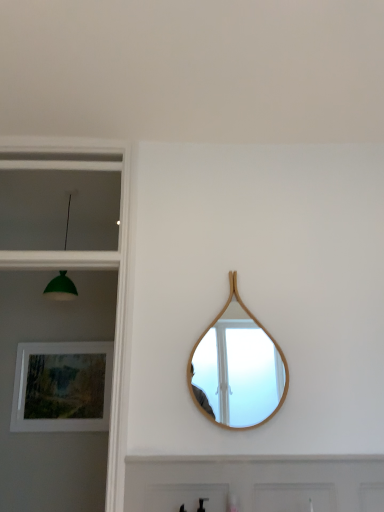
Question: Is white painted wood door at lower center taller than matte wooden picture frame at lower left?

Choices:
 (A) no
 (B) yes

Answer: (A)

Question: Is white painted wood door at lower center at the left side of matte wooden picture frame at lower left?

Choices:
 (A) no
 (B) yes

Answer: (A)

Question: From a real-world perspective, is white painted wood door at lower center on matte wooden picture frame at lower left?

Choices:
 (A) yes
 (B) no

Answer: (B)

Question: Considering the relative sizes of white painted wood door at lower center and matte wooden picture frame at lower left in the image provided, is white painted wood door at lower center shorter than matte wooden picture frame at lower left?

Choices:
 (A) yes
 (B) no

Answer: (A)

Question: Can you confirm if white painted wood door at lower center is wider than matte wooden picture frame at lower left?

Choices:
 (A) no
 (B) yes

Answer: (B)

Question: Is white painted wood door at lower center bigger than matte wooden picture frame at lower left?

Choices:
 (A) yes
 (B) no

Answer: (A)

Question: Does white painted wood door at lower center have a larger size compared to matte glass window at upper left?

Choices:
 (A) no
 (B) yes

Answer: (A)

Question: From a real-world perspective, is white painted wood door at lower center positioned over matte glass window at upper left based on gravity?

Choices:
 (A) no
 (B) yes

Answer: (A)

Question: Is white painted wood door at lower center to the right of matte glass window at upper left from the viewer's perspective?

Choices:
 (A) no
 (B) yes

Answer: (B)

Question: Could you tell me if white painted wood door at lower center is facing matte glass window at upper left?

Choices:
 (A) no
 (B) yes

Answer: (A)

Question: Is white painted wood door at lower center outside matte glass window at upper left?

Choices:
 (A) yes
 (B) no

Answer: (A)

Question: Does white painted wood door at lower center have a greater height compared to matte glass window at upper left?

Choices:
 (A) no
 (B) yes

Answer: (A)

Question: Is green matte lampshade at left surrounding wooden mirror at center?

Choices:
 (A) no
 (B) yes

Answer: (A)